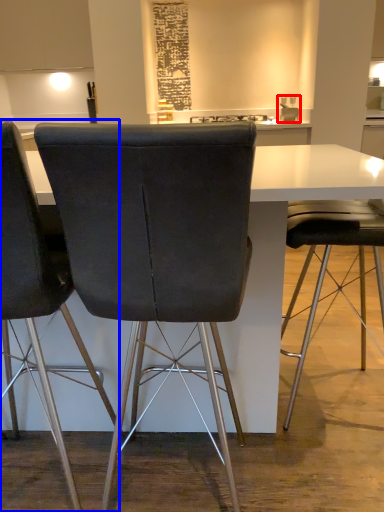
Question: Which of the following is the closest to the observer, sink (highlighted by a red box) or chair (highlighted by a blue box)?

Choices:
 (A) sink
 (B) chair

Answer: (B)